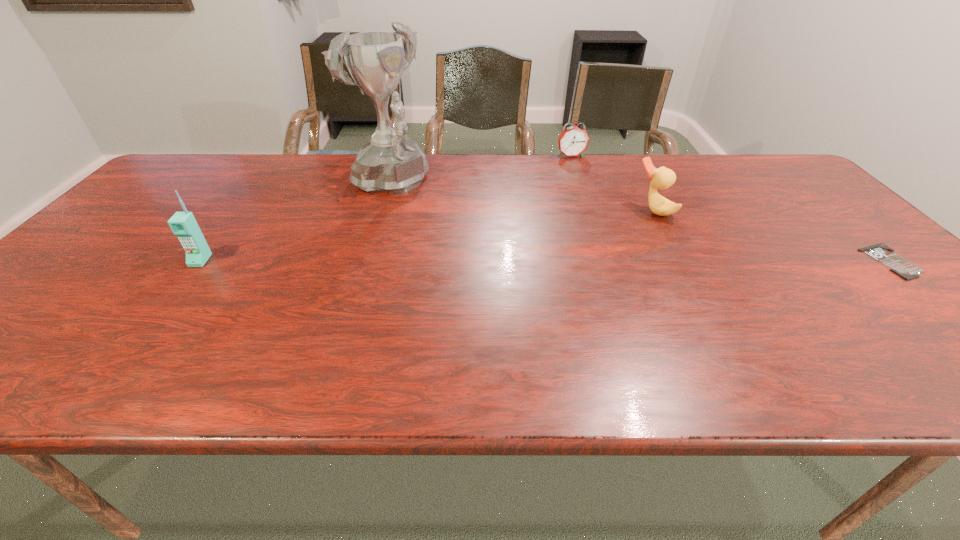
At what (x,y) coordinates should I click in order to perform the action: click on vacant region located on the left of the rightmost object. Please return your answer as a coordinate pair (x, y). This screenshot has height=540, width=960. Looking at the image, I should click on [x=762, y=261].

This screenshot has width=960, height=540. Find the location of `vacant area located 0.370m on the clock face of the third object from right to left`. vacant area located 0.370m on the clock face of the third object from right to left is located at coordinates (612, 220).

Identify the location of vacant space situated on the clock face of the third object from right to left. (590, 184).

Locate an element on the screen. The height and width of the screenshot is (540, 960). free space located on the clock face of the third object from right to left is located at coordinates (589, 183).

At what (x,y) coordinates should I click in order to perform the action: click on vacant space located on the side with emblem of the award. Please return your answer as a coordinate pair (x, y). Looking at the image, I should click on (439, 216).

This screenshot has width=960, height=540. In order to click on vacant point located on the side with emblem of the award in this screenshot , I will do `click(515, 260)`.

The width and height of the screenshot is (960, 540). What are the coordinates of `blank area located 0.210m on the side with emblem of the award` in the screenshot? It's located at (464, 231).

Where is `vacant space located on the beak of the second object from right to left`? The image size is (960, 540). vacant space located on the beak of the second object from right to left is located at coordinates (580, 244).

Find the location of a particular element. The image size is (960, 540). free space located on the beak of the second object from right to left is located at coordinates (619, 227).

Find the location of a particular element. This screenshot has width=960, height=540. vacant space located 0.270m on the beak of the second object from right to left is located at coordinates (568, 248).